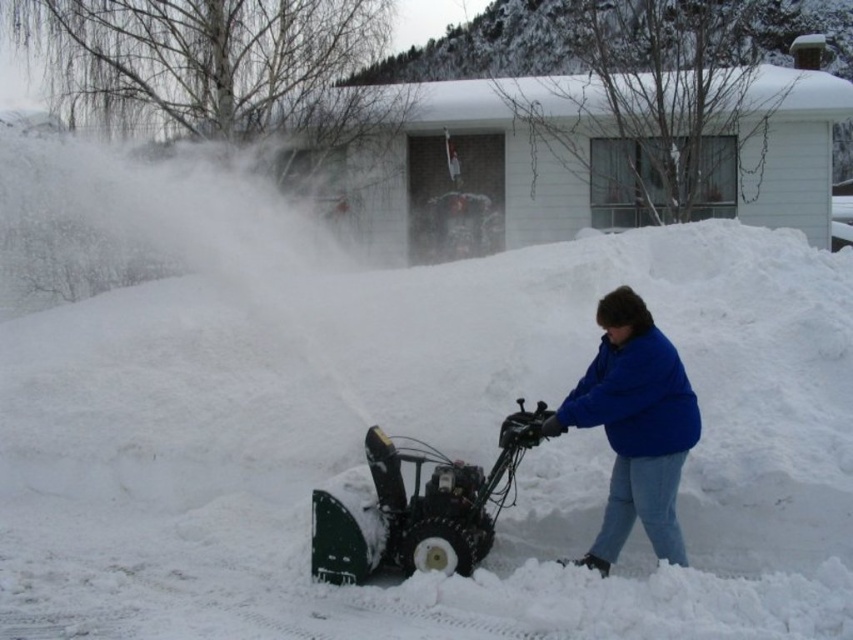
Question: Which object appears farthest from the camera in this image?

Choices:
 (A) white fluffy snow at center
 (B) green plastic snow blower at center

Answer: (B)

Question: Based on their relative distances, which object is farther from the blue fleece jacket at lower right?

Choices:
 (A) green plastic snow blower at center
 (B) white fluffy snow at center

Answer: (B)

Question: Is blue fleece jacket at lower right bigger than green plastic snow blower at center?

Choices:
 (A) yes
 (B) no

Answer: (B)

Question: Which object is closer to the camera taking this photo?

Choices:
 (A) white fluffy snow at center
 (B) blue fleece jacket at lower right

Answer: (A)

Question: Does white fluffy snow at center have a lesser width compared to green plastic snow blower at center?

Choices:
 (A) no
 (B) yes

Answer: (A)

Question: Is white fluffy snow at center to the right of blue fleece jacket at lower right from the viewer's perspective?

Choices:
 (A) yes
 (B) no

Answer: (B)